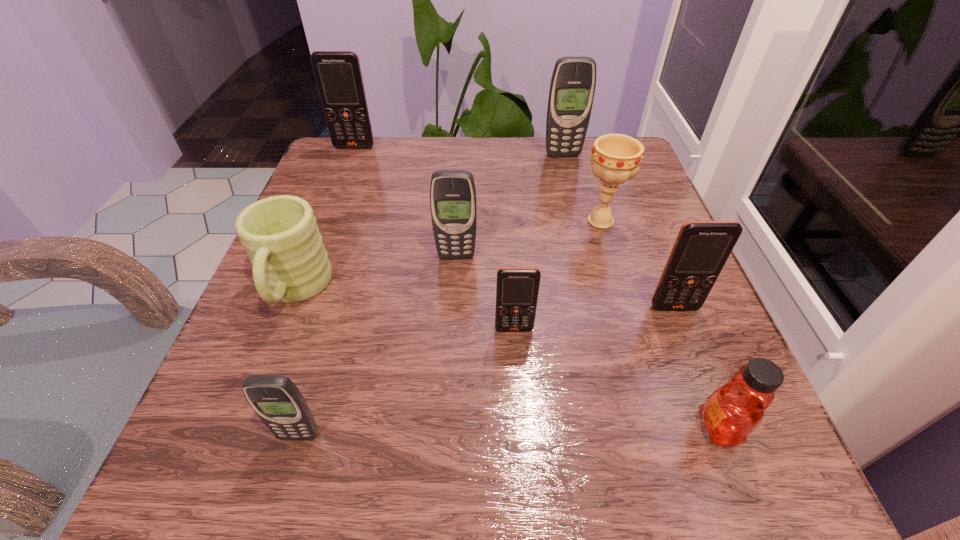
Identify the location of the farthest orange cellular telephone. This screenshot has width=960, height=540. (338, 76).

Identify the location of the leftmost orange cellular telephone. This screenshot has width=960, height=540. (338, 76).

Where is `the rightmost gray cellular telephone`? the rightmost gray cellular telephone is located at coordinates (572, 88).

This screenshot has height=540, width=960. Find the location of `the second farthest cellular telephone`. the second farthest cellular telephone is located at coordinates click(x=572, y=88).

At what (x,y) coordinates should I click in order to perform the action: click on the second farthest gray cellular telephone. Please return your answer as a coordinate pair (x, y). The width and height of the screenshot is (960, 540). Looking at the image, I should click on (453, 205).

Image resolution: width=960 pixels, height=540 pixels. Find the location of `the second biggest gray cellular telephone`. the second biggest gray cellular telephone is located at coordinates (453, 205).

Find the location of a particular element. Image resolution: width=960 pixels, height=540 pixels. the rightmost cellular telephone is located at coordinates (701, 249).

Locate an element on the screen. the rightmost orange cellular telephone is located at coordinates (701, 249).

At what (x,y) coordinates should I click in order to perform the action: click on the seventh nearest object. Please return your answer as a coordinate pair (x, y). The width and height of the screenshot is (960, 540). Looking at the image, I should click on (615, 158).

Identify the location of mug. Image resolution: width=960 pixels, height=540 pixels. (290, 264).